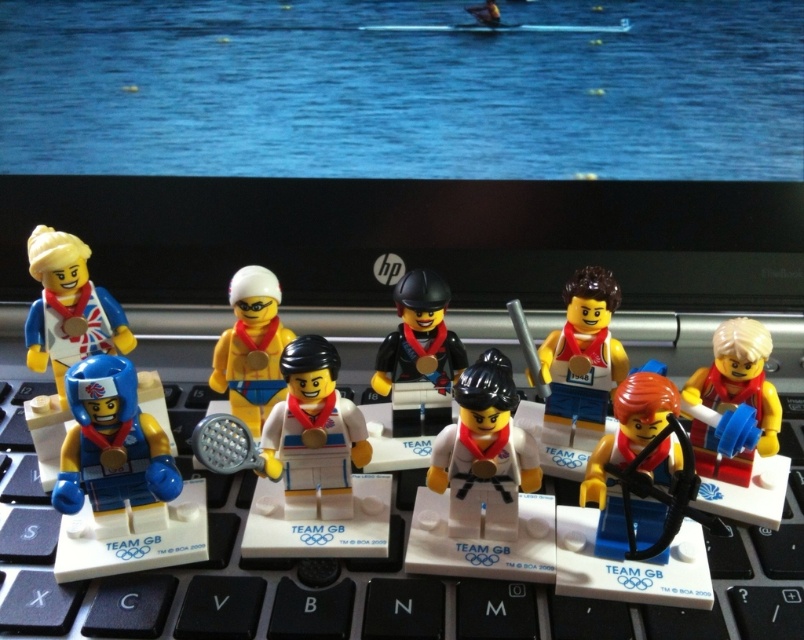
Between blue matte helmet at left and shiny orange helmet at center, which one is positioned higher?

shiny orange helmet at center is higher up.

Can you confirm if blue matte helmet at left is positioned to the right of shiny orange helmet at center?

Incorrect, blue matte helmet at left is not on the right side of shiny orange helmet at center.

Who is more distant from viewer, (146, 520) or (655, 483)?

The point (146, 520) is behind.

The width and height of the screenshot is (804, 640). I want to click on blue matte helmet at left, so click(113, 451).

Based on the photo, who is positioned more to the right, black matte horse at center or yellow matte tennis racket at center?

From the viewer's perspective, black matte horse at center appears more on the right side.

How distant is black matte horse at center from yellow matte tennis racket at center?

The distance of black matte horse at center from yellow matte tennis racket at center is 5.20 inches.

This screenshot has width=804, height=640. What are the coordinates of `black matte horse at center` in the screenshot? It's located at (419, 355).

Is point (461, 401) closer to camera compared to point (413, 417)?

That is True.

Is white matte karate figure at center closer to camera compared to black matte horse at center?

Yes, white matte karate figure at center is in front of black matte horse at center.

Between point (534, 461) and point (419, 282), which one is positioned in front?

Point (534, 461)

The image size is (804, 640). Find the location of `white matte karate figure at center`. white matte karate figure at center is located at coordinates (483, 452).